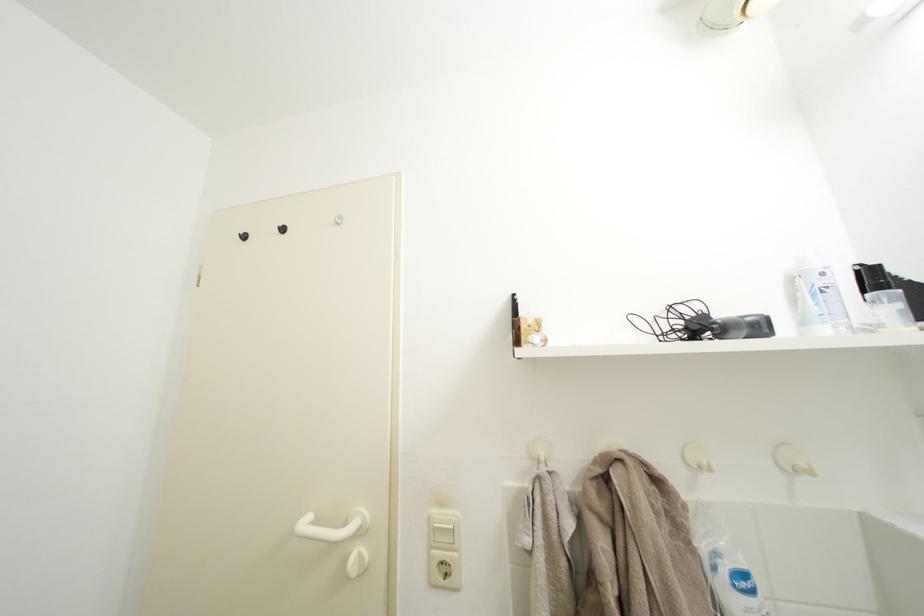
Where would you press the white light switch? Please return your answer as a coordinate pair (x, y).

(444, 533)